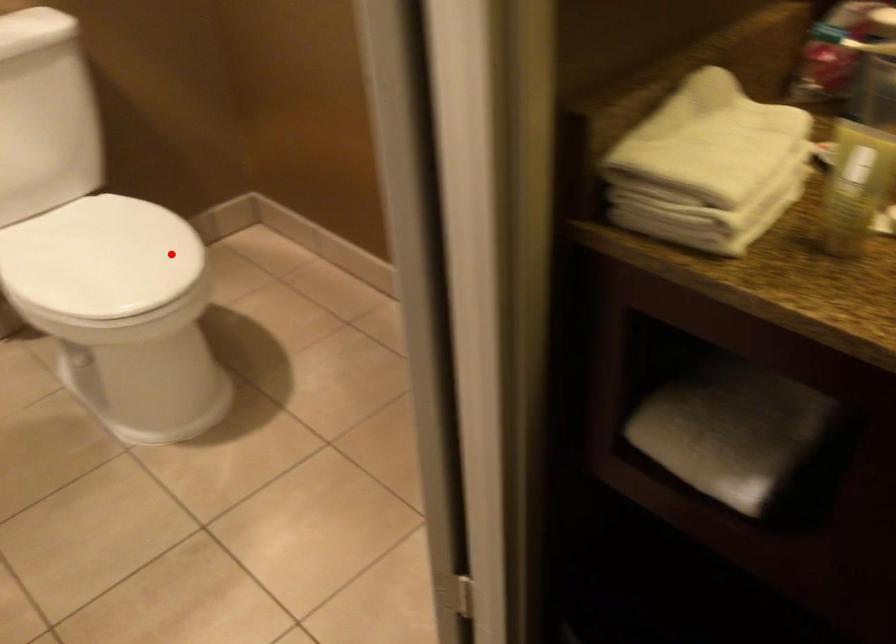
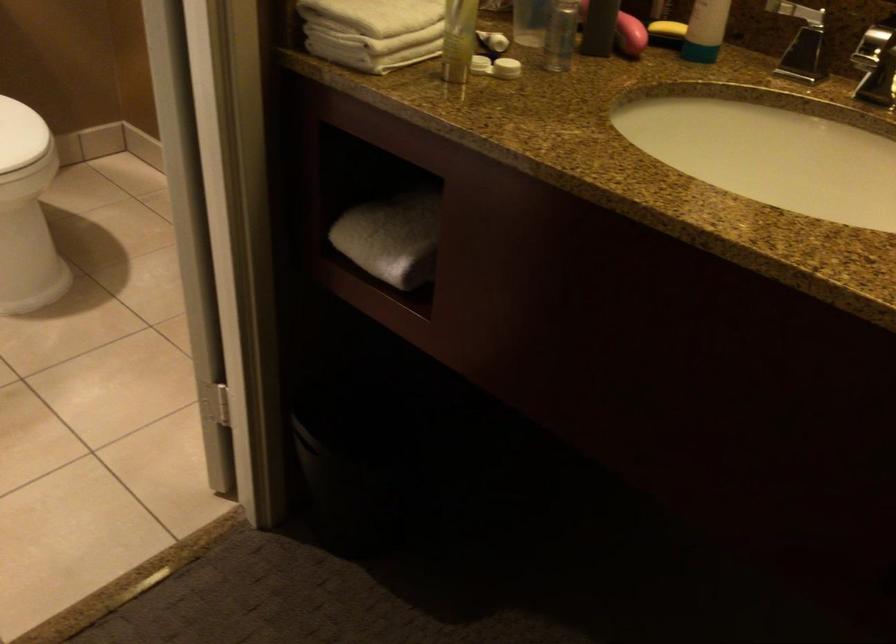
Question: I am providing you with two images of the same scene from different viewpoints. Image1 has a red point marked. In image2, the corresponding 3D location appears at what relative position? Reply with the corresponding letter.

Choices:
 (A) Closer
 (B) Farther

Answer: (B)